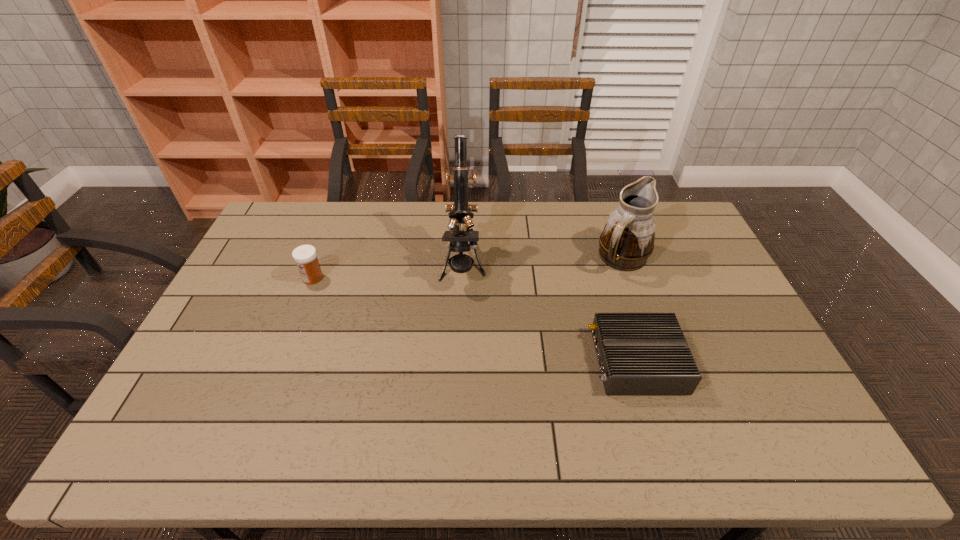
Identify the location of vacant space located 0.130m on the back panel of the router. Image resolution: width=960 pixels, height=540 pixels. (543, 361).

The height and width of the screenshot is (540, 960). What are the coordinates of `free space located on the back panel of the router` in the screenshot? It's located at (562, 361).

Find the location of a particular element. The width and height of the screenshot is (960, 540). free space located on the back panel of the router is located at coordinates (503, 361).

Locate an element on the screen. Image resolution: width=960 pixels, height=540 pixels. microscope that is at the far edge is located at coordinates (460, 213).

Find the location of a particular element. Image resolution: width=960 pixels, height=540 pixels. pitcher located in the far edge section of the desktop is located at coordinates (627, 240).

Locate an element on the screen. The width and height of the screenshot is (960, 540). blank area at the far edge is located at coordinates (346, 216).

The width and height of the screenshot is (960, 540). I want to click on free space at the near edge, so click(x=738, y=428).

Image resolution: width=960 pixels, height=540 pixels. I want to click on vacant area at the left edge, so click(224, 367).

Where is `free spot at the right edge of the desktop`? This screenshot has height=540, width=960. free spot at the right edge of the desktop is located at coordinates (710, 285).

This screenshot has height=540, width=960. I want to click on vacant space at the far left corner of the desktop, so [x=305, y=210].